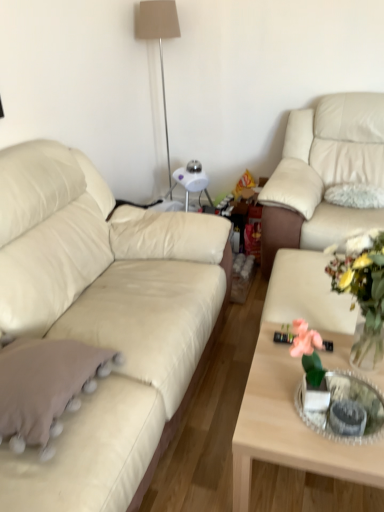
The image size is (384, 512). I want to click on free location above light wood coffee table at center (from a real-world perspective), so click(x=327, y=398).